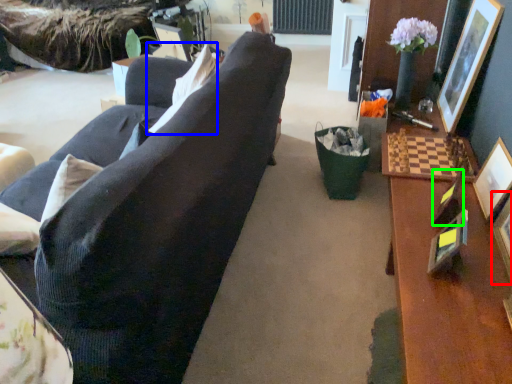
Question: Which object is the closest to the picture frame (highlighted by a red box)? Choose among these: pillow (highlighted by a blue box) or picture frame (highlighted by a green box).

Choices:
 (A) pillow
 (B) picture frame

Answer: (B)